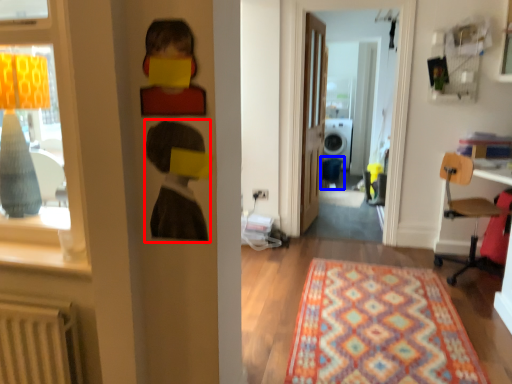
Question: Which point is closer to the camera, person (highlighted by a red box) or armchair (highlighted by a blue box)?

Choices:
 (A) person
 (B) armchair

Answer: (A)